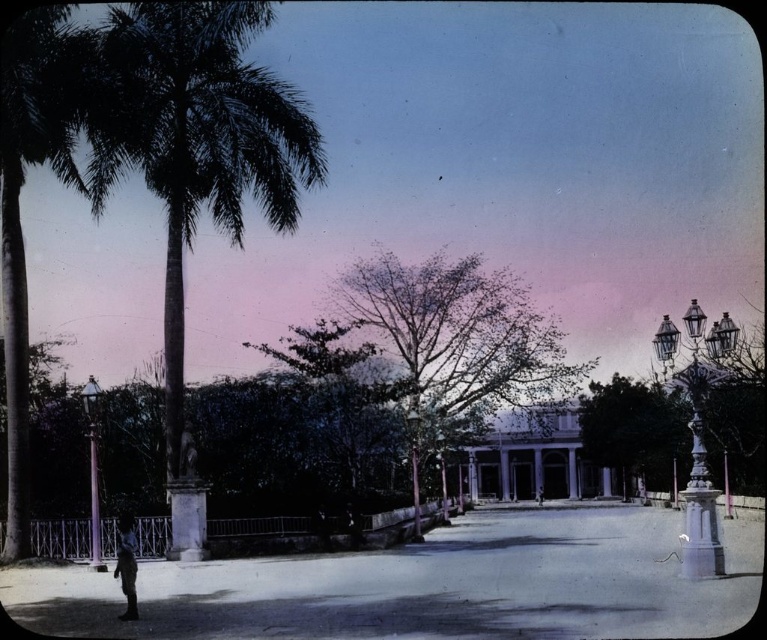
Can you confirm if green leafy palm tree at left is smaller than dark blue fabric at center?

No, green leafy palm tree at left is not smaller than dark blue fabric at center.

Locate an element on the screen. This screenshot has height=640, width=767. green leafy palm tree at left is located at coordinates (18, 211).

Is point (25, 150) farther from camera compared to point (122, 618)?

Yes, it is.

The width and height of the screenshot is (767, 640). What are the coordinates of `green leafy palm tree at left` in the screenshot? It's located at (18, 211).

Is point (124, 548) less distant than point (413, 394)?

Yes, it is.

Between point (133, 534) and point (416, 426), which one is positioned behind?

The point (416, 426) is behind.

Where is `dark blue fabric at center`? The width and height of the screenshot is (767, 640). dark blue fabric at center is located at coordinates (127, 564).

Based on the photo, which is above, green leafy palm tree at left or polished brass lamp post at center?

Positioned higher is green leafy palm tree at left.

Is point (25, 513) behind point (412, 496)?

No.

Locate an element on the screen. The height and width of the screenshot is (640, 767). green leafy palm tree at left is located at coordinates (18, 211).